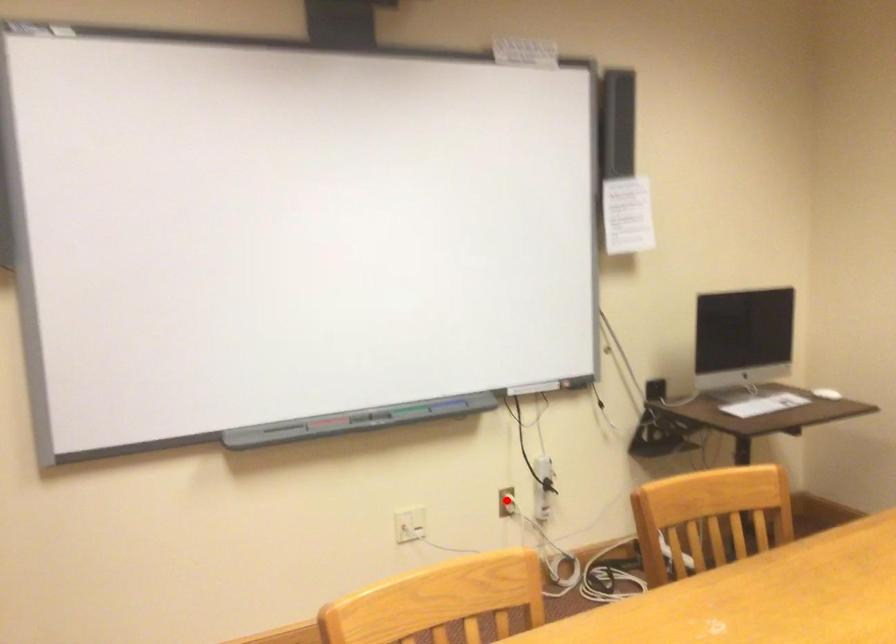
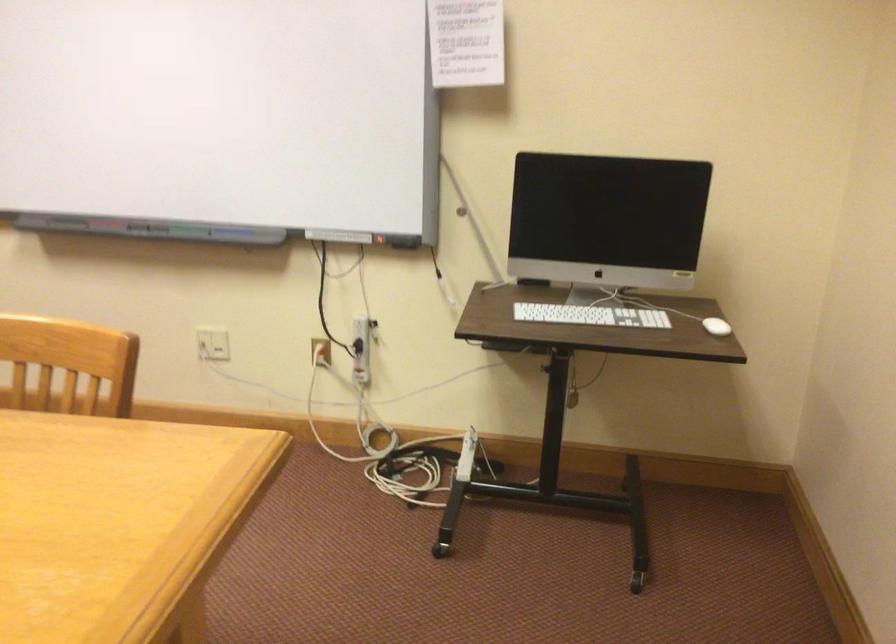
Find the pixel in the second image that matches the highlighted location in the first image.

(321, 351)